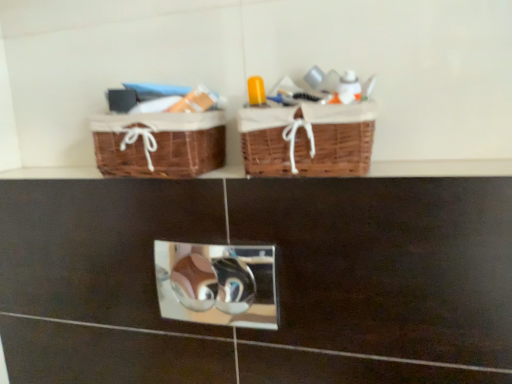
Question: From the image's perspective, is metallic reflective mirror at center located above brown woven picnic basket at left, which is the 2th picnic basket in right-to-left order?

Choices:
 (A) yes
 (B) no

Answer: (B)

Question: Is metallic reflective mirror at center taller than brown woven picnic basket at left, arranged as the first picnic basket when viewed from the left?

Choices:
 (A) yes
 (B) no

Answer: (A)

Question: Does metallic reflective mirror at center have a greater width compared to brown woven picnic basket at left, which is the 2th picnic basket in right-to-left order?

Choices:
 (A) no
 (B) yes

Answer: (A)

Question: Is brown woven picnic basket at left, which is the 2th picnic basket in right-to-left order, at the back of metallic reflective mirror at center?

Choices:
 (A) yes
 (B) no

Answer: (B)

Question: Does metallic reflective mirror at center appear on the right side of brown woven picnic basket at left, arranged as the first picnic basket when viewed from the left?

Choices:
 (A) yes
 (B) no

Answer: (A)

Question: Based on their sizes in the image, would you say brown wicker baskets at upper center is bigger or smaller than woven brown picnic basket at upper center, arranged as the first picnic basket when viewed from the right?

Choices:
 (A) big
 (B) small

Answer: (B)

Question: In terms of height, does brown wicker baskets at upper center look taller or shorter compared to woven brown picnic basket at upper center, which is the 2th picnic basket from left to right?

Choices:
 (A) tall
 (B) short

Answer: (B)

Question: Does point (480, 173) appear closer or farther from the camera than point (239, 130)?

Choices:
 (A) farther
 (B) closer

Answer: (B)

Question: Considering the positions of brown wicker baskets at upper center and woven brown picnic basket at upper center, which is the 2th picnic basket from left to right, in the image, is brown wicker baskets at upper center wider or thinner than woven brown picnic basket at upper center, which is the 2th picnic basket from left to right,?

Choices:
 (A) wide
 (B) thin

Answer: (B)

Question: Does point (358, 168) appear closer or farther from the camera than point (262, 268)?

Choices:
 (A) closer
 (B) farther

Answer: (A)

Question: Based on their sizes in the image, would you say woven brown picnic basket at upper center, which is the 2th picnic basket from left to right, is bigger or smaller than metallic reflective mirror at center?

Choices:
 (A) big
 (B) small

Answer: (A)

Question: Relative to metallic reflective mirror at center, is woven brown picnic basket at upper center, which is the 2th picnic basket from left to right, in front or behind?

Choices:
 (A) behind
 (B) front

Answer: (B)

Question: From a real-world perspective, is woven brown picnic basket at upper center, arranged as the first picnic basket when viewed from the right, above or below metallic reflective mirror at center?

Choices:
 (A) above
 (B) below

Answer: (A)

Question: In terms of size, does metallic reflective mirror at center appear bigger or smaller than brown wicker baskets at upper center?

Choices:
 (A) big
 (B) small

Answer: (A)

Question: Relative to brown wicker baskets at upper center, is metallic reflective mirror at center in front or behind?

Choices:
 (A) behind
 (B) front

Answer: (A)